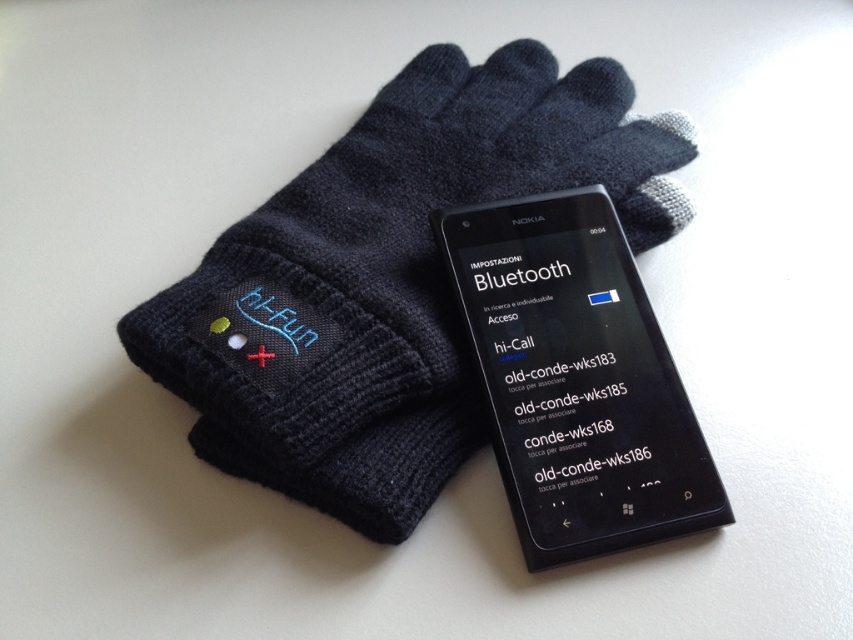
You are organizing a tech gadget display and need to place the black knitted glove at upper center and the black matte smartphone at center on a shelf. The shelf has a height limit of 10 cm. Can both items fit vertically without exceeding the height limit?

The black knitted glove at upper center is taller than the black matte smartphone at center. However, the exact heights are not provided. Without knowing their specific dimensions, it is impossible to determine if they fit within the 10 cm height limit. Additional measurements are required.

Consider the image. You are organizing a gift box and need to place both the black knitted glove at upper center and the black matte smartphone at center inside. The box has a compartment that can only fit items smaller than the glove. Which item should you place in the compartment?

The black matte smartphone at center should be placed in the compartment since it is smaller than the black knitted glove at upper center, which cannot fit in the compartment.

You are organizing items on a desk and need to place a small sticker between the black knitted glove at upper center and the black matte smartphone at center. Based on their positions, where should you place the sticker?

The sticker should be placed between the black knitted glove at upper center and the black matte smartphone at center, as the black knitted glove at upper center is in front of the black matte smartphone at center, so the sticker can be placed behind the glove and in front of the smartphone to position it between them.